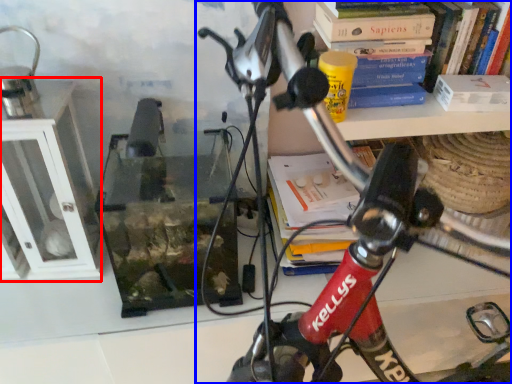
Question: Among these objects, which one is nearest to the camera, shelf (highlighted by a red box) or bicycle (highlighted by a blue box)?

Choices:
 (A) shelf
 (B) bicycle

Answer: (B)